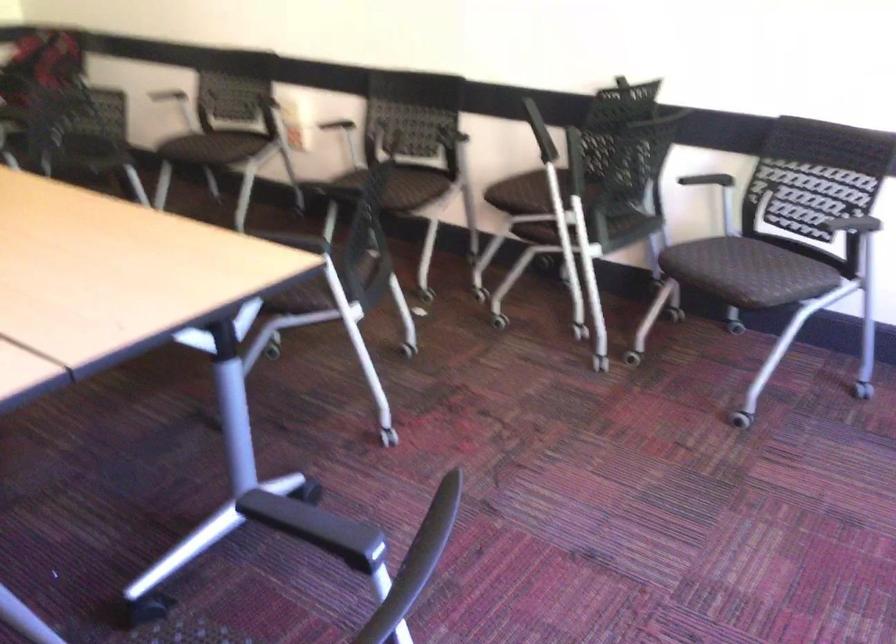
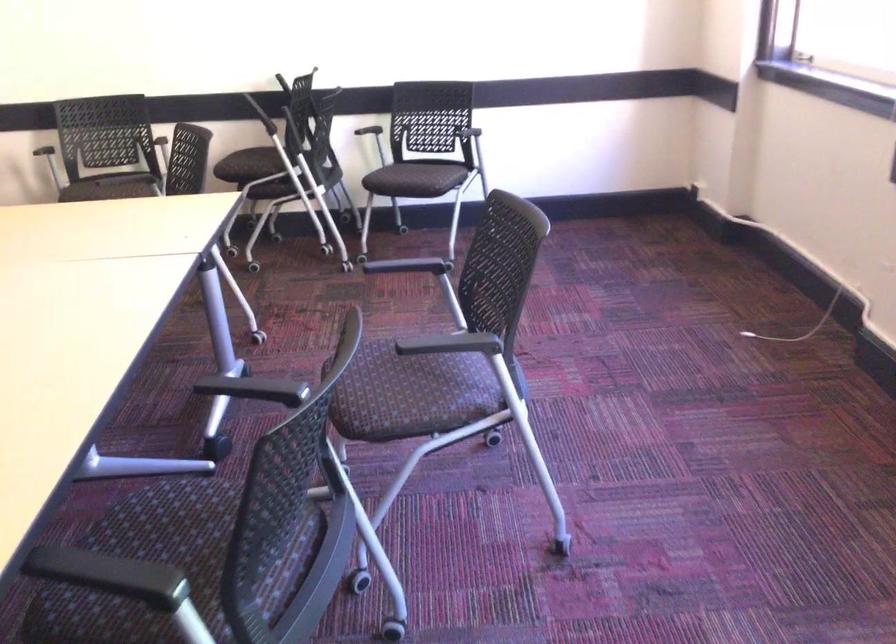
In the second image, find the point that corresponds to the point at 728,281 in the first image.

(415, 178)